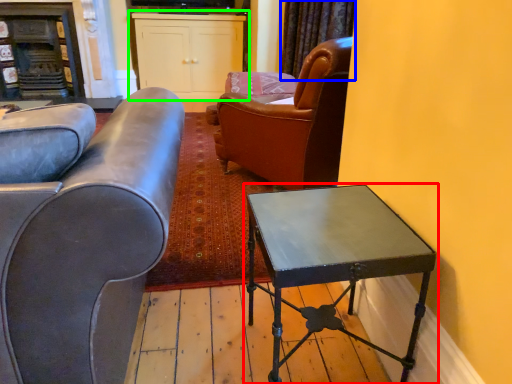
Question: Based on their relative distances, which object is nearer to table (highlighted by a red box)? Choose from curtain (highlighted by a blue box) and cabinetry (highlighted by a green box).

Choices:
 (A) curtain
 (B) cabinetry

Answer: (A)